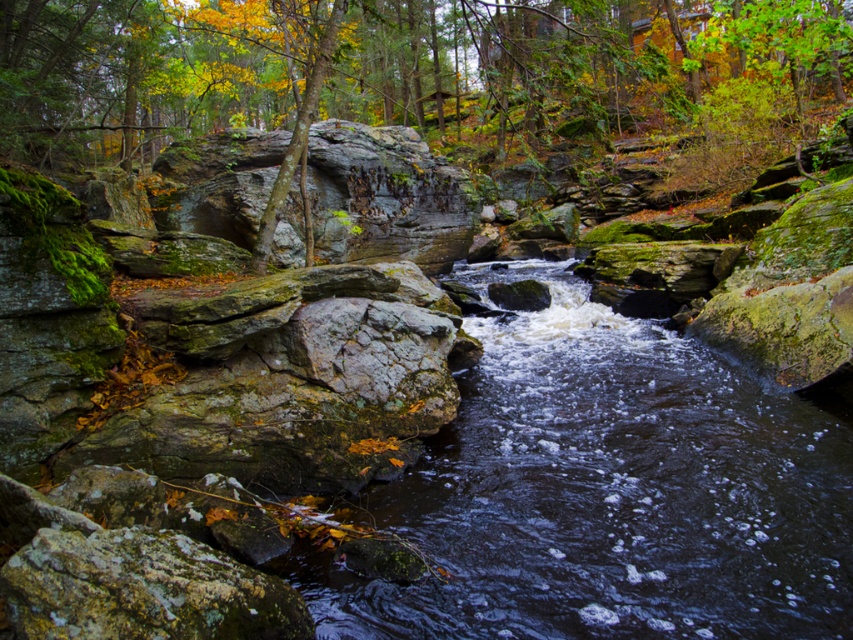
The image size is (853, 640). In order to click on smooth rock stream at center in this screenshot , I will do `click(610, 492)`.

Is smooth rock stream at center positioned before green mossy rock at left?

Yes, smooth rock stream at center is in front of green mossy rock at left.

Is point (386, 625) in front of point (410, 100)?

Yes, it is in front of point (410, 100).

Locate an element on the screen. The image size is (853, 640). smooth rock stream at center is located at coordinates (610, 492).

Does green mossy rock at left have a larger size compared to green mossy rock at center?

Indeed, green mossy rock at left has a larger size compared to green mossy rock at center.

Does point (809, 8) lie in front of point (323, 260)?

Yes, point (809, 8) is in front of point (323, 260).

You are a GUI agent. You are given a task and a screenshot of the screen. Output one action in this format:
    pyautogui.click(x=<x>, y=<y>)
    Task: Click on the green mossy rock at left
    Image resolution: width=853 pixels, height=640 pixels.
    Given the screenshot: What is the action you would take?
    pyautogui.click(x=587, y=70)

What do you see at coordinates (610, 492) in the screenshot? The height and width of the screenshot is (640, 853). I see `smooth rock stream at center` at bounding box center [610, 492].

Who is more forward, (596, 481) or (408, 138)?

Point (596, 481) is in front.

Locate an element on the screen. The image size is (853, 640). smooth rock stream at center is located at coordinates (610, 492).